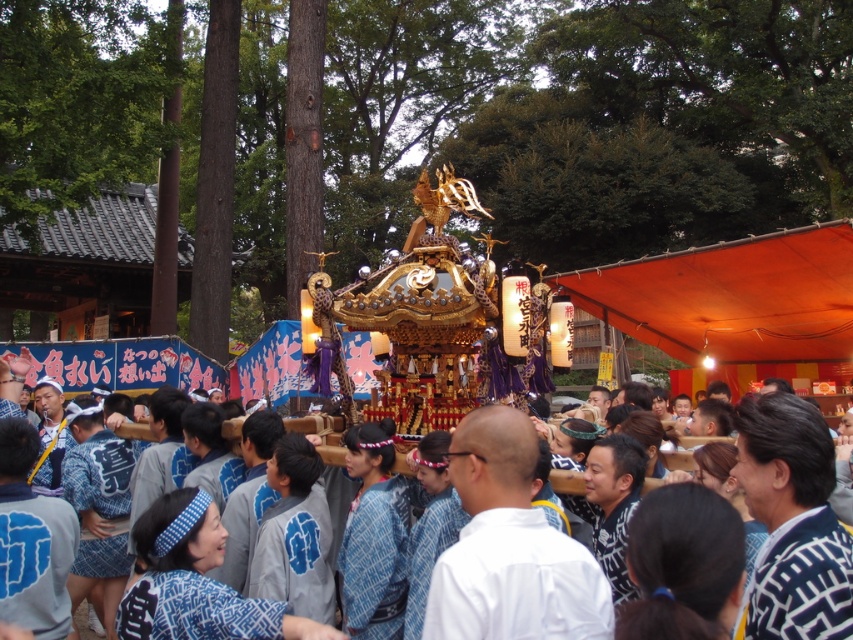
You are a photographer at the festival and want to capture a photo of the white matte robe at center and the blue patterned kimono at center. Which clothing item is shorter in length?

The white matte robe at center is shorter than the blue patterned kimono at center.

You are a photographer standing at the edge of the festival crowd. You want to capture a photo of the white matte robe at center without any obstructions. Based on its position, where should you aim your camera?

The white matte robe at center is located at coordinates point [515,582], so you should aim your camera towards that point to capture it without obstructions.